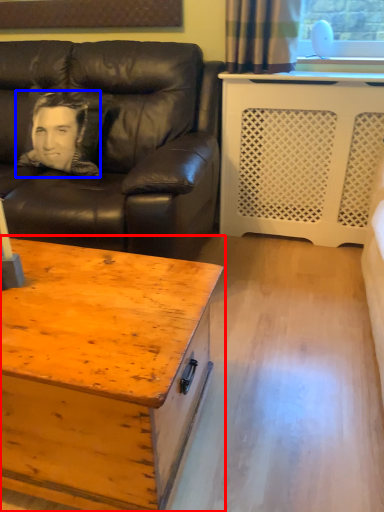
Question: Which object is further to the camera taking this photo, coffee table (highlighted by a red box) or man (highlighted by a blue box)?

Choices:
 (A) coffee table
 (B) man

Answer: (B)